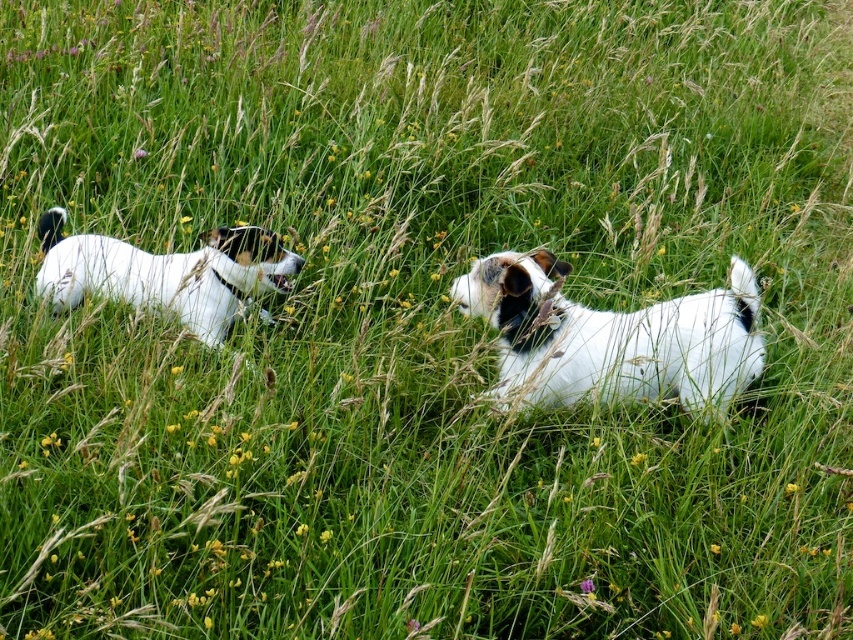
Which of these two, white fur dog at center or white fur dog at left, stands taller?

Standing taller between the two is white fur dog at center.

This screenshot has height=640, width=853. Describe the element at coordinates (612, 337) in the screenshot. I see `white fur dog at center` at that location.

Is point (563, 308) positioned behind point (223, 268)?

No.

This screenshot has width=853, height=640. In order to click on white fur dog at center in this screenshot , I will do `click(612, 337)`.